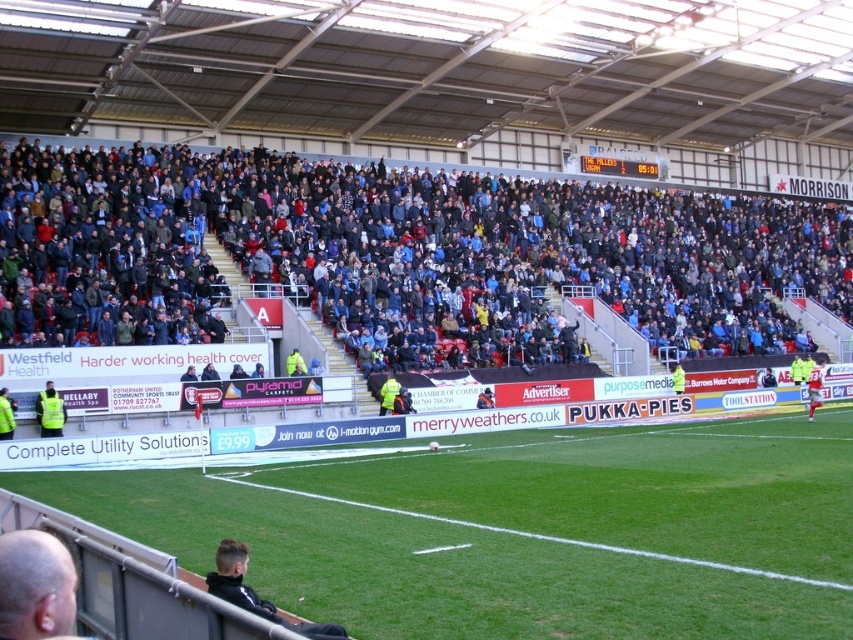
Which is above, bald head at lower left or yellow reflective vest at lower left?

Positioned higher is bald head at lower left.

Find the location of a particular element. This screenshot has width=853, height=640. bald head at lower left is located at coordinates (35, 586).

Can you confirm if bald head at lower left is wider than red jersey at right?

In fact, bald head at lower left might be narrower than red jersey at right.

Between point (67, 632) and point (820, 404), which one is positioned behind?

Positioned behind is point (820, 404).

Find the location of `bald head at lower left`. bald head at lower left is located at coordinates (35, 586).

Is point (831, 602) in front of point (49, 394)?

Yes.

Does green grass football field at center lie behind yellow reflective vest at lower left?

That is False.

Who is more forward, (x=756, y=454) or (x=54, y=420)?

Point (x=756, y=454) is in front.

Where is `green grass football field at center`? This screenshot has width=853, height=640. green grass football field at center is located at coordinates (523, 529).